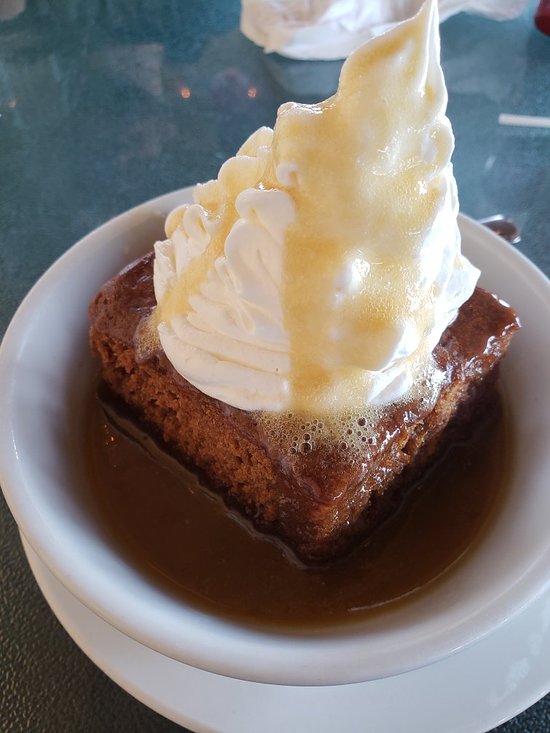
You are a GUI agent. You are given a task and a screenshot of the screen. Output one action in this format:
    pyautogui.click(x=<x>, y=<y>)
    Task: Click on the counter
    The image size is (550, 733).
    Given the screenshot: What is the action you would take?
    pyautogui.click(x=49, y=688)